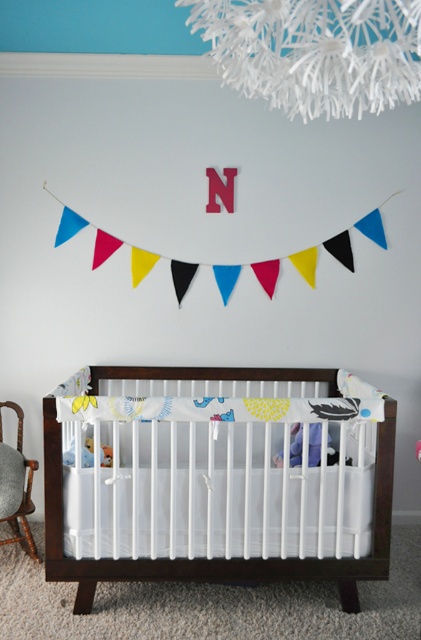
Who is shorter, wooden armchair at left or plush yellow bear at center?

plush yellow bear at center is shorter.

Looking at this image, how much distance is there between wooden armchair at left and plush yellow bear at center?

They are 13.98 inches apart.

Does point (37, 464) lie behind point (69, 458)?

Yes.

Where is `wooden armchair at left`? wooden armchair at left is located at coordinates (15, 484).

Does white wood crib at center appear on the left side of wooden armchair at left?

In fact, white wood crib at center is to the right of wooden armchair at left.

Consider the image. Who is shorter, white wood crib at center or wooden armchair at left?

wooden armchair at left

Is point (135, 444) positioned in front of point (7, 490)?

That is True.

At what (x,y) coordinates should I click in order to perform the action: click on white wood crib at center. Please return your answer as a coordinate pair (x, y). Looking at the image, I should click on (218, 481).

Can you confirm if white wood crib at center is thinner than white paper-like at upper center?

Incorrect, white wood crib at center's width is not less than white paper-like at upper center's.

Is white wood crib at center bigger than white paper-like at upper center?

Yes, white wood crib at center is bigger than white paper-like at upper center.

Between point (343, 540) and point (383, 44), which one is positioned in front?

Point (383, 44) is in front.

This screenshot has height=640, width=421. In order to click on white wood crib at center in this screenshot , I will do `click(218, 481)`.